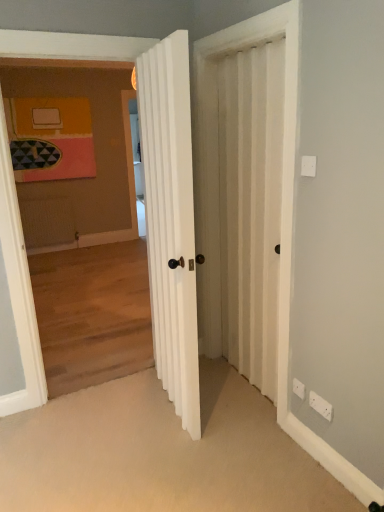
Question: Considering the relative sizes of white ribbed door at center and white plastic electric outlet at lower right, acting as the 2th electric outlet starting from the right, in the image provided, is white ribbed door at center bigger than white plastic electric outlet at lower right, acting as the 2th electric outlet starting from the right,?

Choices:
 (A) no
 (B) yes

Answer: (B)

Question: Is white ribbed door at center positioned beyond the bounds of white plastic electric outlet at lower right, which is counted as the 1th electric outlet, starting from the back?

Choices:
 (A) no
 (B) yes

Answer: (B)

Question: Is the position of white ribbed door at center less distant than that of white plastic electric outlet at lower right, the 1th electric outlet from the left?

Choices:
 (A) no
 (B) yes

Answer: (B)

Question: Could white plastic electric outlet at lower right, acting as the 2th electric outlet starting from the right, be considered to be inside white ribbed door at center?

Choices:
 (A) yes
 (B) no

Answer: (B)

Question: Is white ribbed door at center to the left of white plastic electric outlet at lower right, acting as the 2th electric outlet starting from the right, from the viewer's perspective?

Choices:
 (A) yes
 (B) no

Answer: (A)

Question: Is point (327, 418) positioned closer to the camera than point (296, 385)?

Choices:
 (A) closer
 (B) farther

Answer: (A)

Question: Is white plastic electric outlet at lower right, the second electric outlet when ordered from left to right, bigger or smaller than white plastic electric outlet at lower right, acting as the 2th electric outlet starting from the right?

Choices:
 (A) small
 (B) big

Answer: (B)

Question: Is white plastic electric outlet at lower right, positioned as the 1th electric outlet in front-to-back order, wider or thinner than white plastic electric outlet at lower right, acting as the 2th electric outlet starting from the front?

Choices:
 (A) thin
 (B) wide

Answer: (B)

Question: From their relative heights in the image, would you say white plastic electric outlet at lower right, which appears as the second electric outlet when viewed from the back, is taller or shorter than white plastic electric outlet at lower right, acting as the 2th electric outlet starting from the front?

Choices:
 (A) tall
 (B) short

Answer: (A)

Question: In terms of width, does white plastic electric outlet at lower right, positioned as the 1th electric outlet in front-to-back order, look wider or thinner when compared to white ribbed door at center?

Choices:
 (A) thin
 (B) wide

Answer: (A)

Question: Considering the positions of point (331, 411) and point (198, 394), is point (331, 411) closer or farther from the camera than point (198, 394)?

Choices:
 (A) farther
 (B) closer

Answer: (B)

Question: Choose the correct answer: Is white plastic electric outlet at lower right, which appears as the second electric outlet when viewed from the back, inside white ribbed door at center or outside it?

Choices:
 (A) outside
 (B) inside

Answer: (A)

Question: Is white plastic electric outlet at lower right, positioned as the 1th electric outlet in front-to-back order, taller or shorter than white ribbed door at center?

Choices:
 (A) short
 (B) tall

Answer: (A)

Question: From a real-world perspective, is white ribbed door at center positioned above or below white plastic electric outlet at lower right, acting as the 2th electric outlet starting from the front?

Choices:
 (A) above
 (B) below

Answer: (A)

Question: Is white ribbed door at center in front of or behind white plastic electric outlet at lower right, acting as the 2th electric outlet starting from the front, in the image?

Choices:
 (A) front
 (B) behind

Answer: (A)